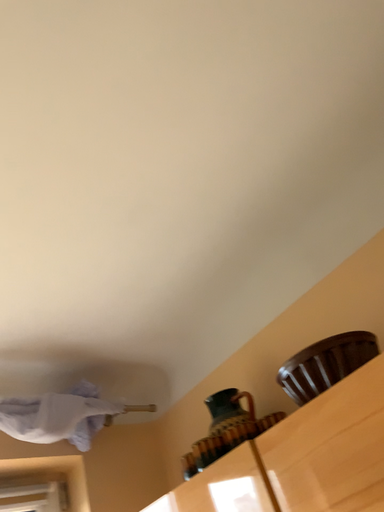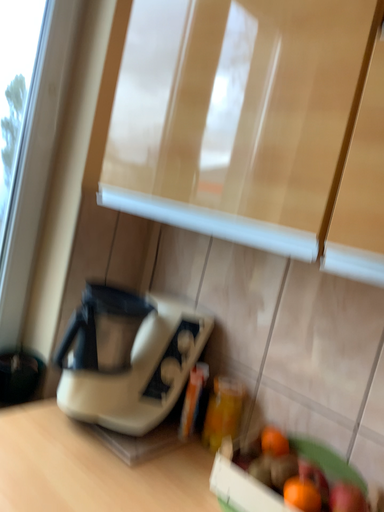
Question: How did the camera likely rotate when shooting the video?

Choices:
 (A) rotated right
 (B) rotated left

Answer: (B)